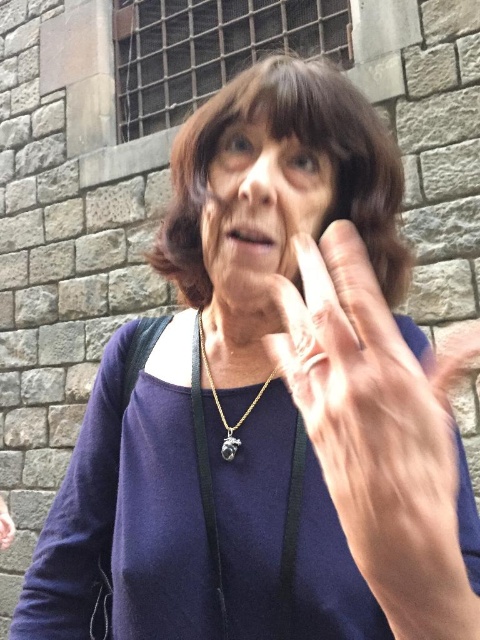
Looking at this image, you are a photographer adjusting the focus of your camera. The camera can only focus on objects within a 5 inch range. You are currently focusing on the smooth skin face at center. Will the gold metallic pendant at center also be in focus?

The smooth skin face at center is 7.08 inches away from the gold metallic pendant at center. Since the camera can only focus on objects within a 5 inch range, the pendant is outside this range and will not be in focus.

You are a photographer adjusting your camera settings. You notice the smooth skin face at center and the gold metallic pendant at center in your frame. Which object should you focus on to ensure the subject is sharp while the other appears slightly blurred?

The smooth skin face at center is closer to the viewer than the gold metallic pendant at center, so focusing on the smooth skin face at center will keep it sharp while the pendant appears blurred.